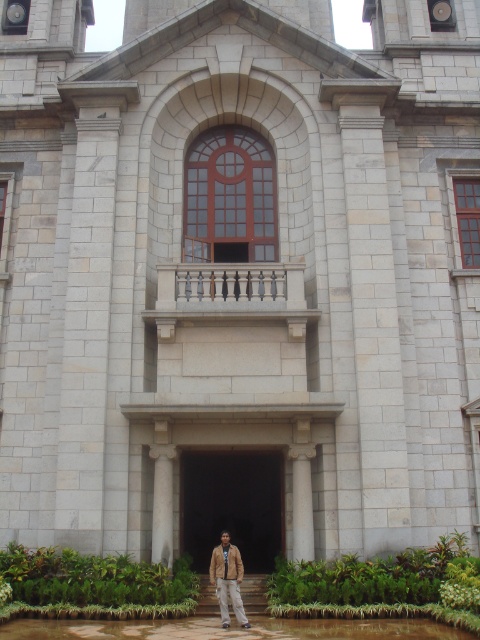
Question: Which point appears farthest from the camera in this image?

Choices:
 (A) (160, 550)
 (B) (226, 548)
 (C) (302, 464)
 (D) (250, 529)

Answer: (D)

Question: Is dark stone door at center bigger than brown leather jacket at lower center?

Choices:
 (A) no
 (B) yes

Answer: (B)

Question: Can you confirm if dark stone door at center is positioned to the left of white marble pillar at center?

Choices:
 (A) yes
 (B) no

Answer: (B)

Question: Which point is closer to the camera taking this photo?

Choices:
 (A) (168, 536)
 (B) (312, 544)
 (C) (230, 586)

Answer: (C)

Question: Is dark stone door at center to the left of brown leather jacket at lower center from the viewer's perspective?

Choices:
 (A) yes
 (B) no

Answer: (B)

Question: Based on their relative distances, which object is farther from the white marble pillar at center?

Choices:
 (A) dark stone door at center
 (B) white marble column at center
 (C) brown leather jacket at lower center

Answer: (A)